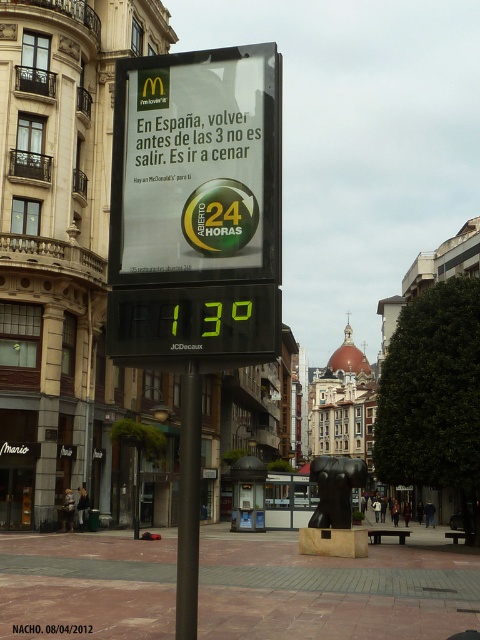
You are a pedestrian who wants to read the white paper sign at center and the black metal pole at center. Which object is located to the left of the other?

The white paper sign at center is positioned on the left side of black metal pole at center.

Looking at this image, you are a pedestrian walking down the street and notice the white paper sign at center and the black metal pole at center. Which object appears shorter in the image?

The white paper sign at center has a lesser height compared to the black metal pole at center, so the white paper sign at center appears shorter.

You are a pedestrian standing in front of the digital billboard and looking at the white paper sign at center and the black metal pole at center. Which object is closer to you?

The white paper sign at center is closer to you than the black metal pole at center because it is further to the viewer.